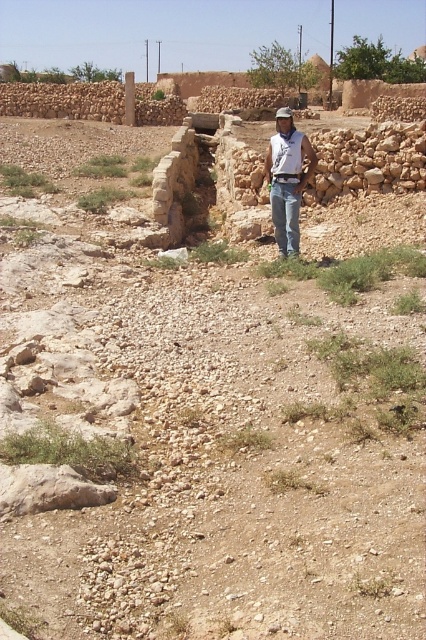
In the scene shown: Can you confirm if denim at center is positioned above brown fabric baseball hat at center?

Incorrect, denim at center is not positioned above brown fabric baseball hat at center.

Who is positioned more to the left, denim at center or brown fabric baseball hat at center?

From the viewer's perspective, denim at center appears more on the left side.

Who is more distant from viewer, (279,193) or (281,109)?

The point (281,109) is behind.

Identify the location of denim at center. (285, 216).

Can you confirm if white denim jeans at center is positioned to the right of denim at center?

Yes, white denim jeans at center is to the right of denim at center.

Is point (291, 228) closer to camera compared to point (298, 216)?

No, (291, 228) is further to viewer.

Where is `white denim jeans at center`? This screenshot has height=640, width=426. white denim jeans at center is located at coordinates (287, 180).

Which is in front, point (282, 224) or point (290, 109)?

Positioned in front is point (282, 224).

The image size is (426, 640). Find the location of `white denim jeans at center`. white denim jeans at center is located at coordinates (287, 180).